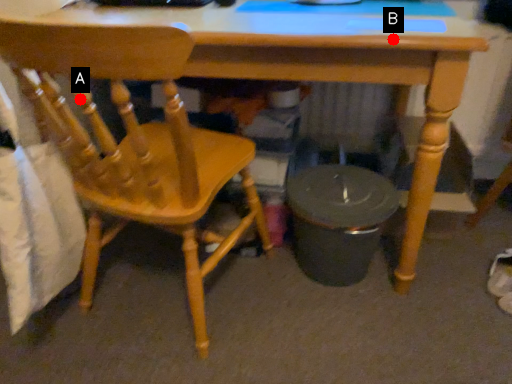
Question: Two points are circled on the image, labeled by A and B beside each circle. Which point is farther to the camera?

Choices:
 (A) A is further
 (B) B is further

Answer: (B)